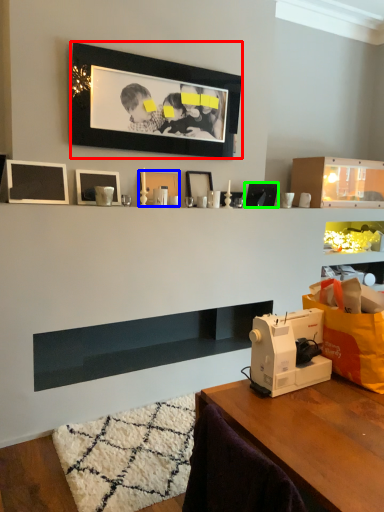
Question: Considering the real-world distances, which object is farthest from picture frame (highlighted by a red box)? picture frame (highlighted by a blue box) or picture frame (highlighted by a green box)?

Choices:
 (A) picture frame
 (B) picture frame

Answer: (B)